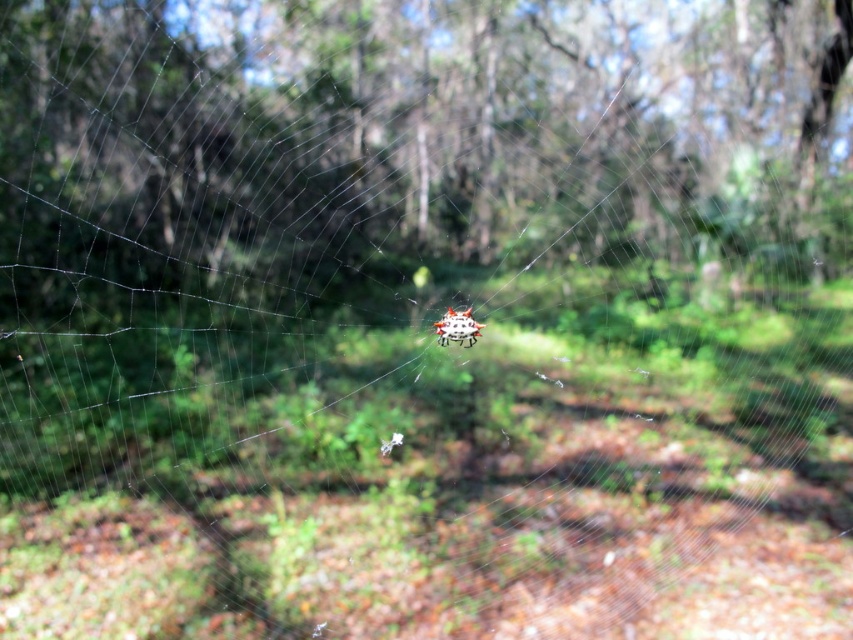
You are a bird flying through the forest and notice a green leafy tree at center and a translucent spiky orb at center. Which object is closer to you as you fly past?

The green leafy tree at center is closer to you because it is positioned in front of the translucent spiky orb at center.

You are a bird flying through the forest and see the green leafy tree at center and the translucent spiky orb at center. Which one is more to the right?

The green leafy tree at center is positioned on the right side of the translucent spiky orb at center, so the green leafy tree at center is more to the right.

You are a small insect flying towards the translucent spiky orb at center. There is a green leafy tree at center in your path. Will you hit the tree before reaching the orb?

The distance between the green leafy tree at center and the translucent spiky orb at center is 4.92 meters. Since you are flying towards the orb, you will hit the tree first if it is closer. However, the description states the distance between them is 4.92 meters, but it doesn not specify which is closer. Without knowing the exact positions, we cannot determine the order of collision.